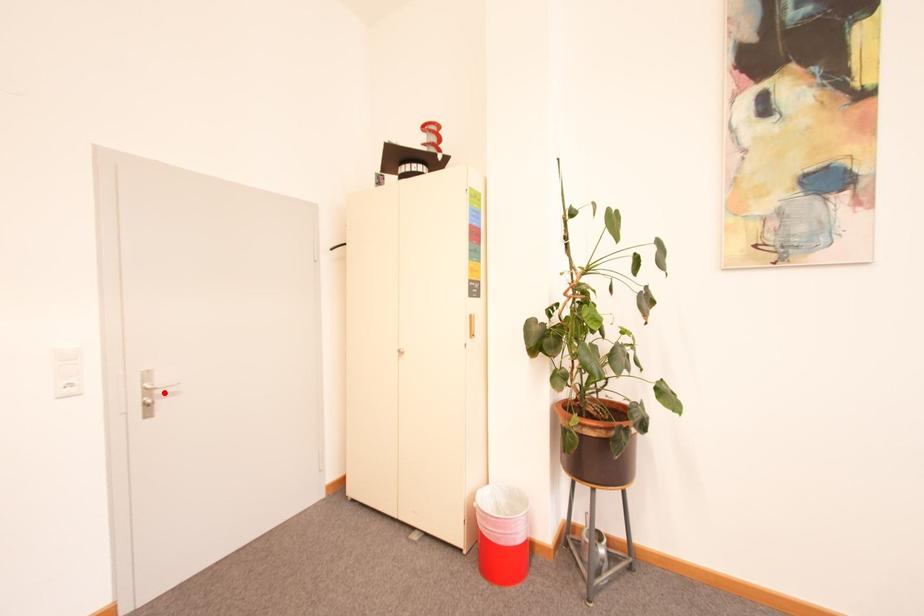
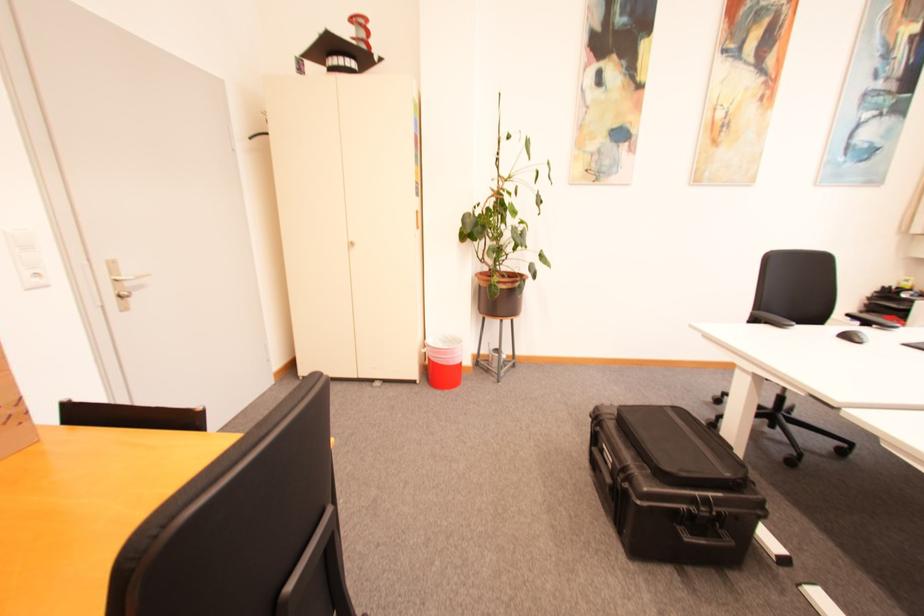
The point at the highlighted location is marked in the first image. Where is the corresponding point in the second image?

(134, 285)